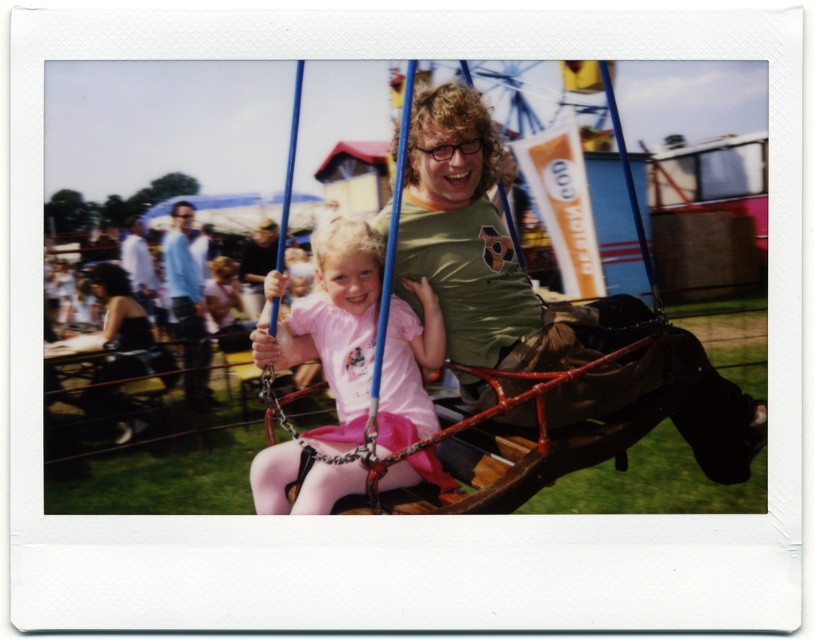
Is matte black shirt at center wider than white shirt at left?

No.

This screenshot has width=814, height=640. What are the coordinates of `matte black shirt at center` in the screenshot? It's located at (257, 266).

This screenshot has width=814, height=640. Identify the location of wooden swing at center. (374, 198).

Can you confirm if wooden swing at center is wider than light blue shirt at left?

Yes, wooden swing at center is wider than light blue shirt at left.

Does point (349, 157) lie behind point (169, 211)?

Yes, point (349, 157) is behind point (169, 211).

The height and width of the screenshot is (640, 814). In order to click on wooden swing at center in this screenshot , I will do `click(374, 198)`.

Is pink fabric dress at center below white shirt at left?

Indeed, pink fabric dress at center is positioned under white shirt at left.

Who is more distant from viewer, [434,332] or [133,250]?

Point [133,250]

Find the location of a particular element. pink fabric dress at center is located at coordinates (335, 326).

The image size is (814, 640). I want to click on pink fabric dress at center, so click(x=335, y=326).